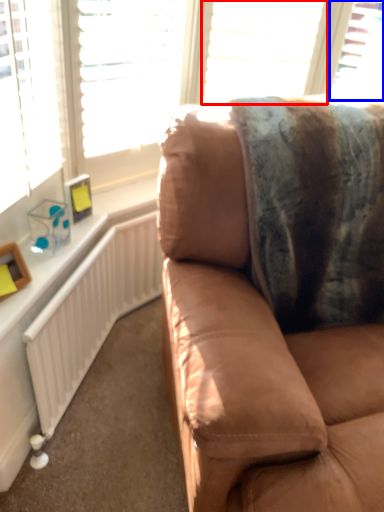
Question: Which point is closer to the camera, blind (highlighted by a red box) or window (highlighted by a blue box)?

Choices:
 (A) blind
 (B) window

Answer: (A)